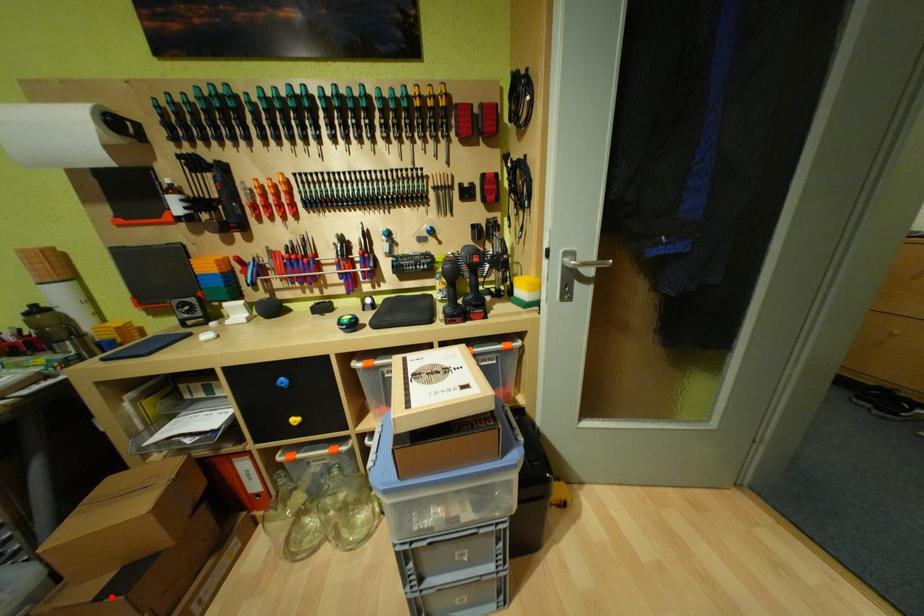
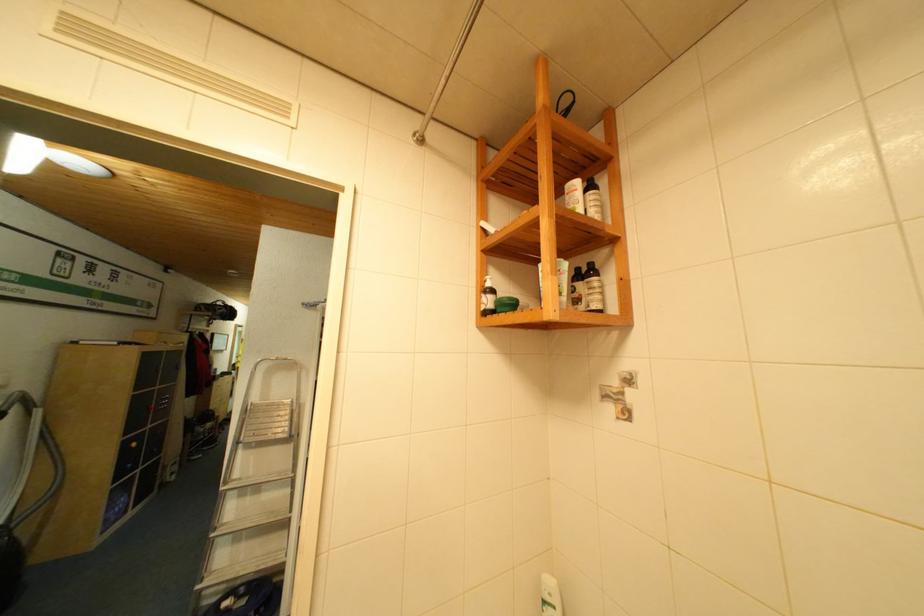
Question: I am providing you with two images of the same scene from different viewpoints. A red point is marked on the first image. Can you still see the location of the red point in image 2?

Choices:
 (A) Yes
 (B) No

Answer: (B)